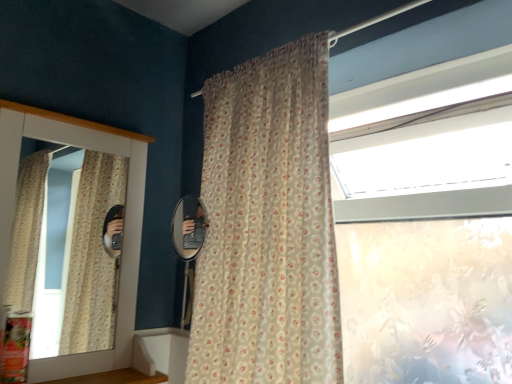
Question: In which direction should I rotate to look at translucent floral-patterned curtain at center?

Choices:
 (A) right
 (B) left

Answer: (B)

Question: Does translucent floral-patterned curtain at center touch wooden at lower left?

Choices:
 (A) no
 (B) yes

Answer: (A)

Question: From a real-world perspective, is translucent floral-patterned curtain at center on wooden at lower left?

Choices:
 (A) no
 (B) yes

Answer: (B)

Question: Does translucent floral-patterned curtain at center lie behind wooden at lower left?

Choices:
 (A) yes
 (B) no

Answer: (B)

Question: Can you confirm if translucent floral-patterned curtain at center is bigger than wooden at lower left?

Choices:
 (A) yes
 (B) no

Answer: (A)

Question: Would you say translucent floral-patterned curtain at center contains wooden at lower left?

Choices:
 (A) yes
 (B) no

Answer: (B)

Question: Can you confirm if translucent floral-patterned curtain at center is taller than wooden at lower left?

Choices:
 (A) yes
 (B) no

Answer: (A)

Question: Considering the relative positions of wooden at lower left and translucent floral-patterned curtain at center in the image provided, is wooden at lower left in front of translucent floral-patterned curtain at center?

Choices:
 (A) no
 (B) yes

Answer: (A)

Question: From the image's perspective, is wooden at lower left below translucent floral-patterned curtain at center?

Choices:
 (A) yes
 (B) no

Answer: (A)

Question: Does wooden at lower left have a lesser width compared to translucent floral-patterned curtain at center?

Choices:
 (A) yes
 (B) no

Answer: (A)

Question: Considering the relative sizes of wooden at lower left and translucent floral-patterned curtain at center in the image provided, is wooden at lower left shorter than translucent floral-patterned curtain at center?

Choices:
 (A) no
 (B) yes

Answer: (B)

Question: Is wooden at lower left at the left side of translucent floral-patterned curtain at center?

Choices:
 (A) no
 (B) yes

Answer: (B)

Question: Is the depth of wooden at lower left greater than that of translucent floral-patterned curtain at center?

Choices:
 (A) no
 (B) yes

Answer: (B)

Question: From a real-world perspective, does matte white medicine cabinet at left stand above translucent floral-patterned curtain at center?

Choices:
 (A) yes
 (B) no

Answer: (B)